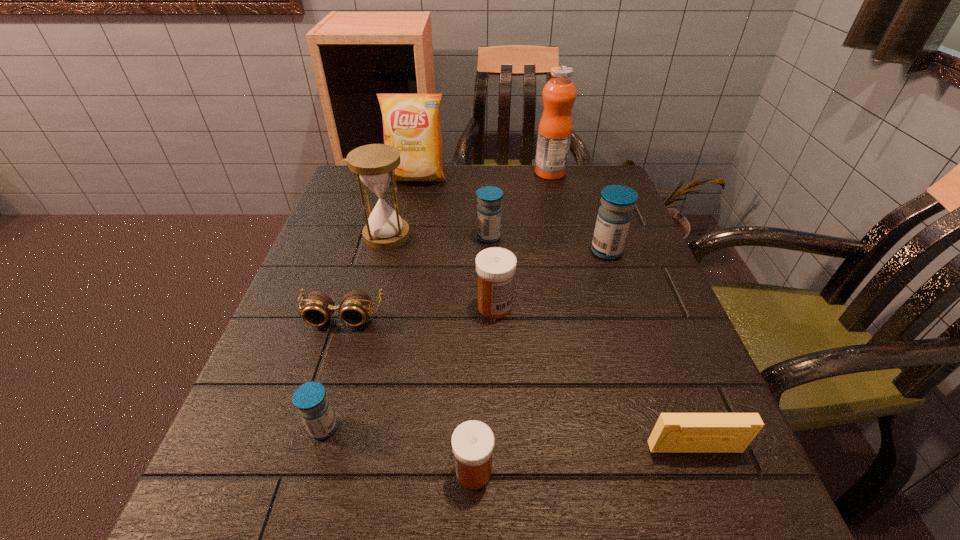
Where is `the tallest object`? The width and height of the screenshot is (960, 540). the tallest object is located at coordinates (555, 127).

Identify the location of the third object from right to left. The height and width of the screenshot is (540, 960). (555, 127).

Identify the location of crisp (potato chip). (411, 122).

Identify the location of white hourglass. This screenshot has height=540, width=960. (374, 164).

Find the location of `the rightmost medicine`. the rightmost medicine is located at coordinates (614, 216).

This screenshot has height=540, width=960. What are the coordinates of `the tallest medicine` in the screenshot? It's located at (614, 216).

Where is `the second smallest blue medicine`? the second smallest blue medicine is located at coordinates [x=489, y=209].

Where is `the third farthest medicine`? the third farthest medicine is located at coordinates pos(496,267).

The height and width of the screenshot is (540, 960). Identify the location of the farther white medicine. (496, 267).

Locate an element on the screen. the nearest medicine is located at coordinates [x=472, y=441].